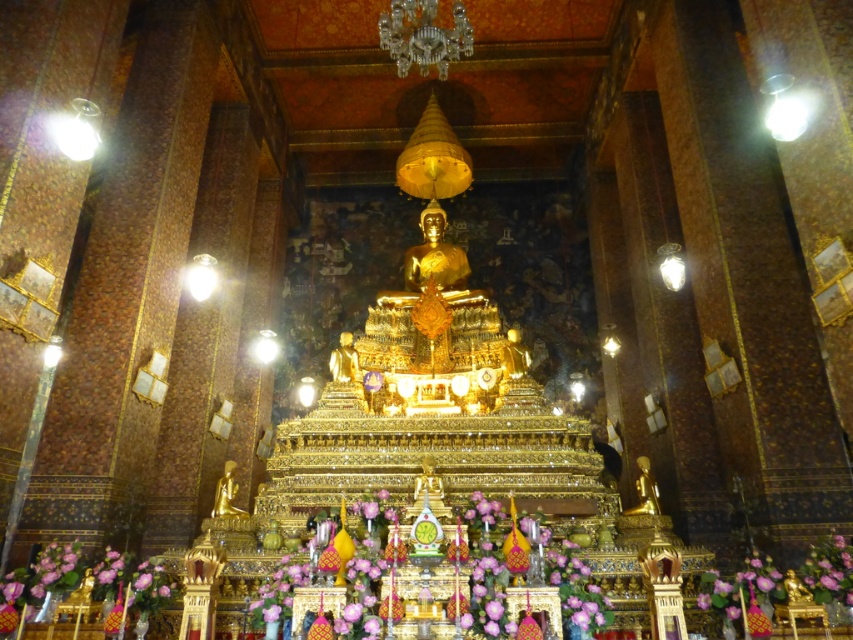
Question: Observing the image, what is the correct spatial positioning of purple silk flower at center in reference to gold polished statue at center?

Choices:
 (A) above
 (B) below

Answer: (B)

Question: Can you confirm if purple silk flowers at center is positioned below gold polished statue at center?

Choices:
 (A) yes
 (B) no

Answer: (B)

Question: Among these points, which one is nearest to the camera?

Choices:
 (A) (654, 509)
 (B) (234, 486)

Answer: (A)

Question: Can you confirm if purple silk flowers at center is thinner than purple silk flower at center?

Choices:
 (A) yes
 (B) no

Answer: (B)

Question: Which point is farther from the camera taking this photo?

Choices:
 (A) (647, 465)
 (B) (352, 502)
 (C) (839, 576)
 (D) (225, 474)

Answer: (D)

Question: Which of the following is the closest to the observer?

Choices:
 (A) (572, 544)
 (B) (656, 497)
 (C) (210, 515)
 (D) (850, 570)

Answer: (D)